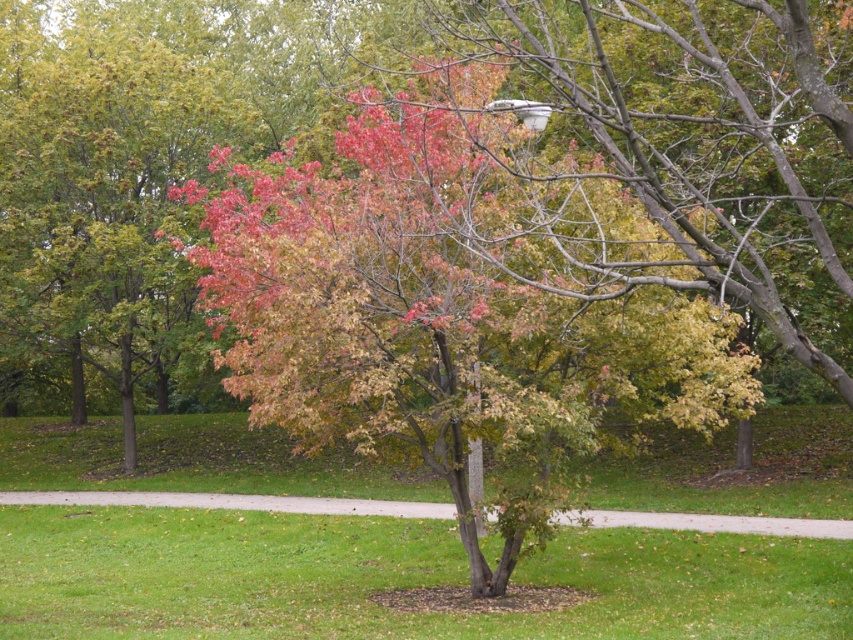
Who is shorter, multicolored foliage at center or concrete sidewalk at center?

Standing shorter between the two is multicolored foliage at center.

Is multicolored foliage at center to the right of concrete sidewalk at center from the viewer's perspective?

Indeed, multicolored foliage at center is positioned on the right side of concrete sidewalk at center.

Between point (553, 358) and point (3, 500), which one is positioned in front?

Point (553, 358)

Locate an element on the screen. Image resolution: width=853 pixels, height=640 pixels. multicolored foliage at center is located at coordinates (450, 304).

Is green grass at center to the right of concrete sidewalk at center from the viewer's perspective?

Yes, green grass at center is to the right of concrete sidewalk at center.

Is green grass at center shorter than concrete sidewalk at center?

Indeed, green grass at center has a lesser height compared to concrete sidewalk at center.

Locate an element on the screen. green grass at center is located at coordinates (393, 579).

Does multicolored foliage at center come in front of green grass at center?

No.

Between multicolored foliage at center and green grass at center, which one appears on the right side from the viewer's perspective?

Positioned to the right is multicolored foliage at center.

Is point (341, 413) farther from viewer compared to point (10, 557)?

No, it is not.

You are a GUI agent. You are given a task and a screenshot of the screen. Output one action in this format:
    pyautogui.click(x=<x>, y=<y>)
    Task: Click on the multicolored foliage at center
    
    Given the screenshot: What is the action you would take?
    pyautogui.click(x=450, y=304)